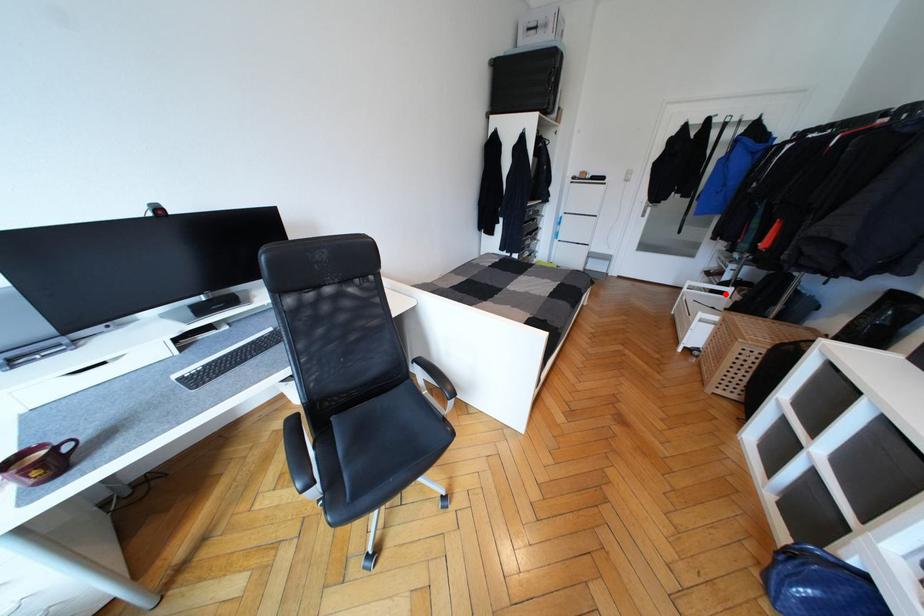
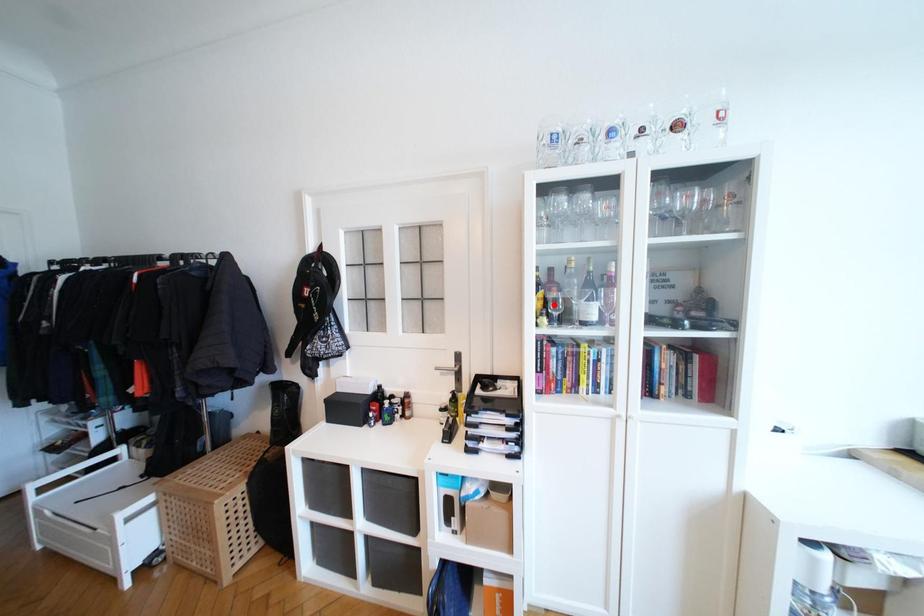
I am providing you with two images of the same scene from different viewpoints. A red point is marked on the first image and another point is marked on the second image. Do the highlighted points in image1 and image2 indicate the same real-world spot?

No